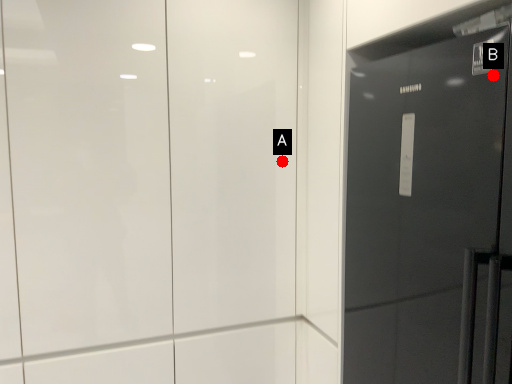
Question: Two points are circled on the image, labeled by A and B beside each circle. Which of the following is the farthest from the observer?

Choices:
 (A) A is further
 (B) B is further

Answer: (A)